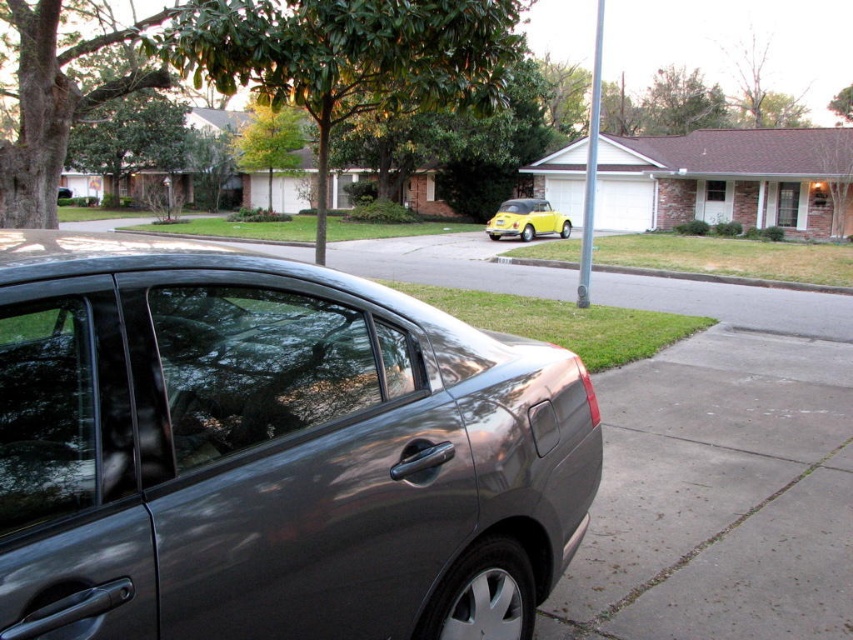
Question: Which point is farther from the camera taking this photo?

Choices:
 (A) (772, 285)
 (B) (525, 218)
 (C) (656, 620)
 (D) (500, 456)

Answer: (B)

Question: Is satin metallic sedan at center in front of gray concrete curb at lower center?

Choices:
 (A) yes
 (B) no

Answer: (A)

Question: Which point is farther to the camera?

Choices:
 (A) (509, 205)
 (B) (705, 404)
 (C) (392, 593)

Answer: (A)

Question: Does gray concrete curb at lower center appear over yellow matte car at center?

Choices:
 (A) yes
 (B) no

Answer: (B)

Question: Is gray concrete pavement at lower right below gray concrete curb at lower center?

Choices:
 (A) no
 (B) yes

Answer: (B)

Question: Which point is closer to the camera taking this photo?

Choices:
 (A) (45, 244)
 (B) (824, 548)
 (C) (544, 198)

Answer: (A)